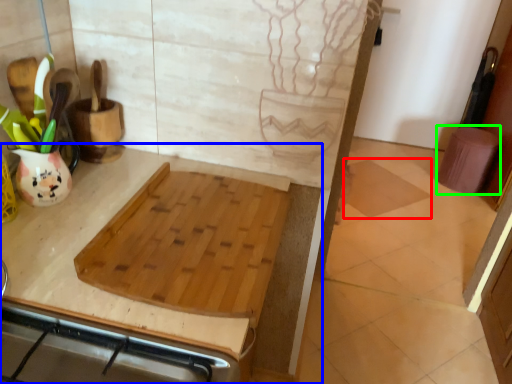
Question: Which object is the farthest from tile (highlighted by a red box)? Choose among these: countertop (highlighted by a blue box) or step stool (highlighted by a green box).

Choices:
 (A) countertop
 (B) step stool

Answer: (A)